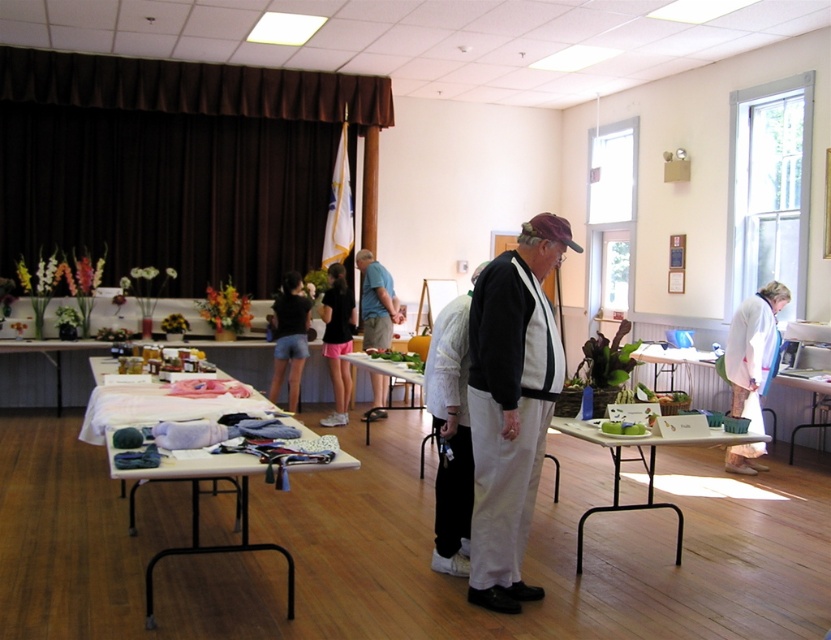
Is white plastic table at center to the right of light blue fabric at center from the viewer's perspective?

Yes, white plastic table at center is to the right of light blue fabric at center.

Find the location of a particular element. The width and height of the screenshot is (831, 640). white plastic table at center is located at coordinates (643, 467).

Between white fabric at right and white plastic table at center, which one is positioned lower?

Positioned lower is white plastic table at center.

Which is behind, point (760, 310) or point (739, 436)?

Positioned behind is point (760, 310).

What are the coordinates of `white fabric at right` in the screenshot? It's located at (753, 349).

Measure the distance between white fabric table at lower left and camera.

white fabric table at lower left is 2.70 meters from camera.

Who is higher up, white fabric table at lower left or white fabric table at center?

white fabric table at center is higher up.

Is point (205, 547) closer to viewer compared to point (367, 369)?

That is True.

At what (x,y) coordinates should I click in order to perform the action: click on white fabric table at lower left. Please return your answer as a coordinate pair (x, y). Looking at the image, I should click on (198, 518).